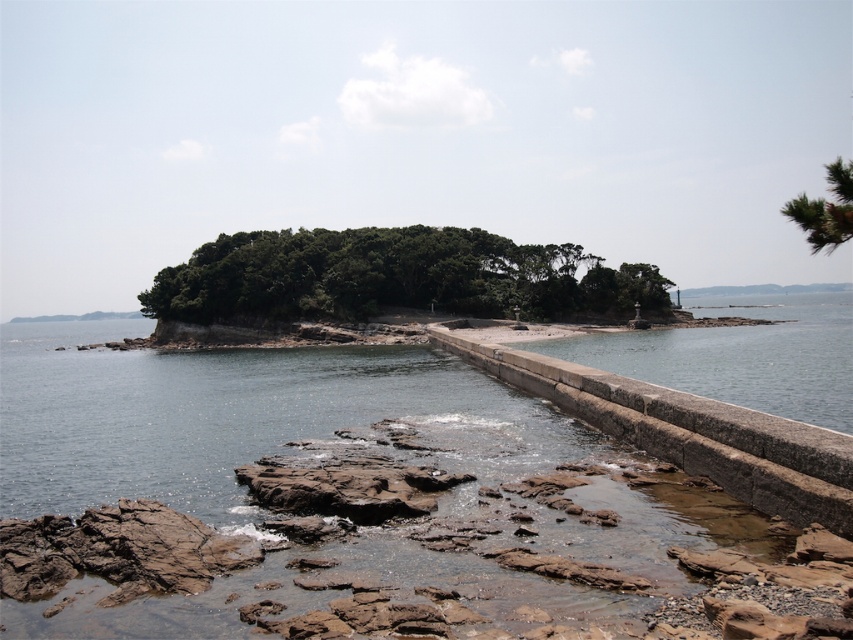
You are a boat captain navigating through the coastal scene. You see the point at coordinates (341, 490). What is the nature of the location at this point?

The point at coordinates (341, 490) is located on clear water at center, so it is safe for navigation.

You are a kayaker planning to navigate through the clear water at center and the green textured pine tree at upper right. Which path has a narrower width for your kayak?

The clear water at center has a width less than the green textured pine tree at upper right, so the path through the clear water at center is narrower.